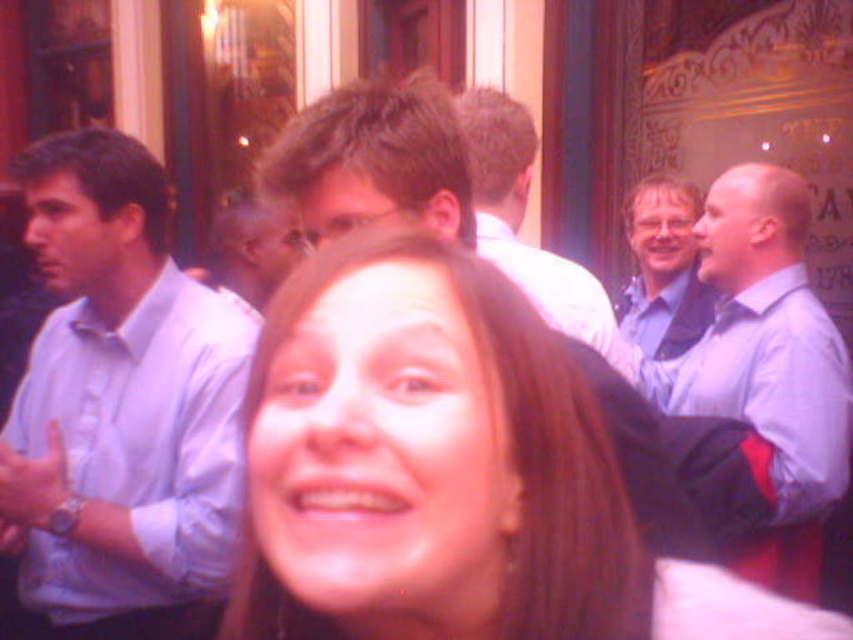
Is matte white shirt at center thinner than blue shirt at center?

No, matte white shirt at center is not thinner than blue shirt at center.

In the scene shown: Is matte white shirt at center taller than blue shirt at center?

Yes, matte white shirt at center is taller than blue shirt at center.

This screenshot has width=853, height=640. What are the coordinates of `matte white shirt at center` in the screenshot? It's located at (521, 221).

At what (x,y) coordinates should I click in order to perform the action: click on matte white shirt at center. Please return your answer as a coordinate pair (x, y). Looking at the image, I should click on (521, 221).

Based on the photo, can you confirm if smooth skin face at center is positioned to the right of matte white shirt at center?

Incorrect, smooth skin face at center is not on the right side of matte white shirt at center.

Does point (434, 419) lie behind point (469, 97)?

No, (434, 419) is in front of (469, 97).

Does point (474, 332) lie behind point (611, 324)?

No.

You are a GUI agent. You are given a task and a screenshot of the screen. Output one action in this format:
    pyautogui.click(x=<x>, y=<y>)
    Task: Click on the smooth skin face at center
    The width and height of the screenshot is (853, 640).
    Given the screenshot: What is the action you would take?
    pyautogui.click(x=450, y=472)

Who is shorter, smooth skin face at center or light blue shirt at right?

smooth skin face at center is shorter.

Is smooth skin face at center positioned in front of light blue shirt at right?

Yes, it is.

Does point (583, 568) come closer to viewer compared to point (776, 332)?

Yes.

What are the coordinates of `smooth skin face at center` in the screenshot? It's located at (450, 472).